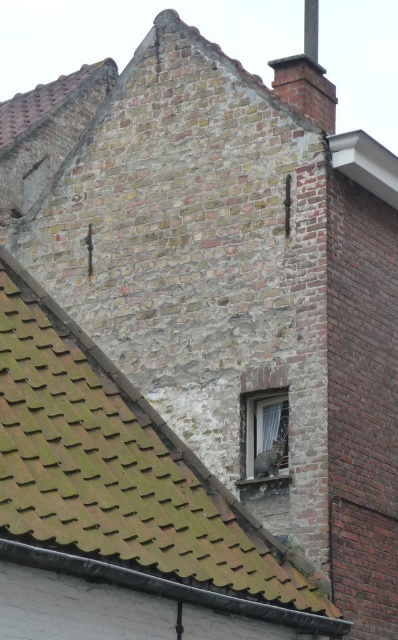
Who is more distant from viewer, [310,36] or [286,451]?

Positioned behind is point [310,36].

Can you confirm if brick chimney at upper right is bigger than white sheer curtain at center?

Yes.

Is point (325, 81) farther from camera compared to point (282, 396)?

Yes, it is behind point (282, 396).

Find the location of a particular element. Image resolution: width=398 pixels, height=640 pixels. brick chimney at upper right is located at coordinates (306, 76).

Does brown shingles at upper left appear on the left side of brick chimney at upper right?

Correct, you'll find brown shingles at upper left to the left of brick chimney at upper right.

Is brown shingles at upper left behind brick chimney at upper right?

No, brown shingles at upper left is closer to the viewer.

The height and width of the screenshot is (640, 398). Identify the location of brown shingles at upper left. (120, 506).

Who is more forward, (154, 600) or (273, 438)?

Point (154, 600) is in front.

Who is higher up, brown shingles at upper left or white sheer curtain at center?

white sheer curtain at center

Identify the location of brown shingles at upper left. This screenshot has width=398, height=640. (120, 506).

The image size is (398, 640). I want to click on brown shingles at upper left, so click(120, 506).